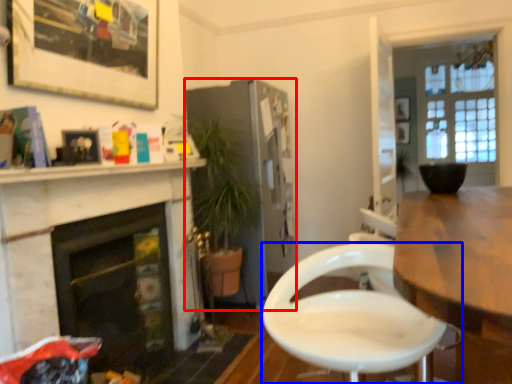
Question: Which of the following is the farthest to the observer, cabinetry (highlighted by a red box) or chair (highlighted by a blue box)?

Choices:
 (A) cabinetry
 (B) chair

Answer: (A)